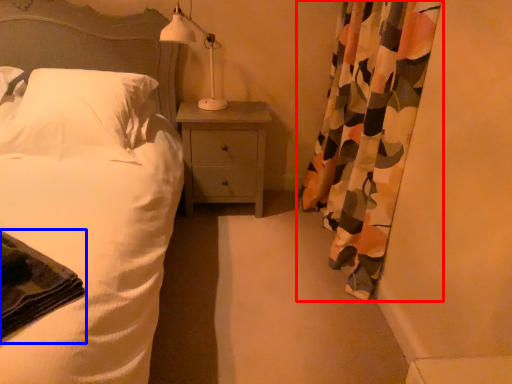
Question: Which of the following is the closest to the observer, curtain (highlighted by a red box) or material (highlighted by a blue box)?

Choices:
 (A) curtain
 (B) material

Answer: (B)